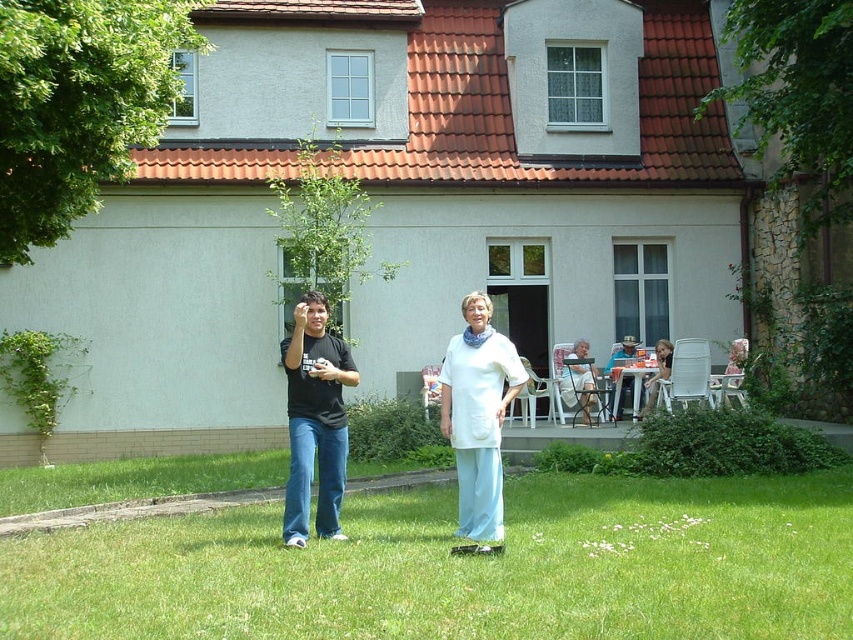
Does white cotton shirt at center appear on the right side of white fabric chair at lower right?

In fact, white cotton shirt at center is to the left of white fabric chair at lower right.

Does white cotton shirt at center have a greater width compared to white fabric chair at lower right?

Correct, the width of white cotton shirt at center exceeds that of white fabric chair at lower right.

Where is `white cotton shirt at center`? The width and height of the screenshot is (853, 640). white cotton shirt at center is located at coordinates (479, 416).

I want to click on white cotton shirt at center, so click(x=479, y=416).

Who is more distant from viewer, (299,435) or (666,355)?

The point (666,355) is more distant.

Image resolution: width=853 pixels, height=640 pixels. Identify the location of black matte shirt at center. (315, 419).

Between point (566, 364) and point (630, 352), which one is positioned behind?

The point (630, 352) is behind.

Is white fabric chair at lower right taller than matte white table at center?

Indeed, white fabric chair at lower right has a greater height compared to matte white table at center.

What do you see at coordinates (578, 380) in the screenshot? The width and height of the screenshot is (853, 640). I see `white fabric chair at lower right` at bounding box center [578, 380].

In order to click on white fabric chair at lower right in this screenshot , I will do `click(578, 380)`.